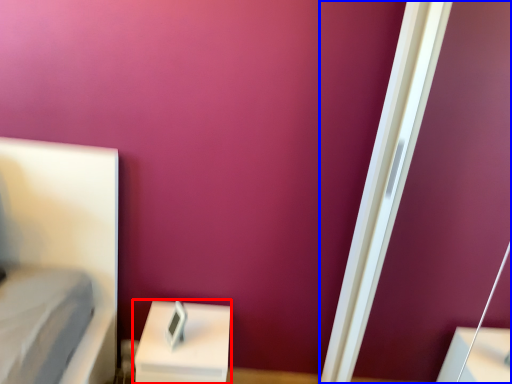
Question: Which object appears farthest to the camera in this image, furniture (highlighted by a red box) or screen door (highlighted by a blue box)?

Choices:
 (A) furniture
 (B) screen door

Answer: (A)